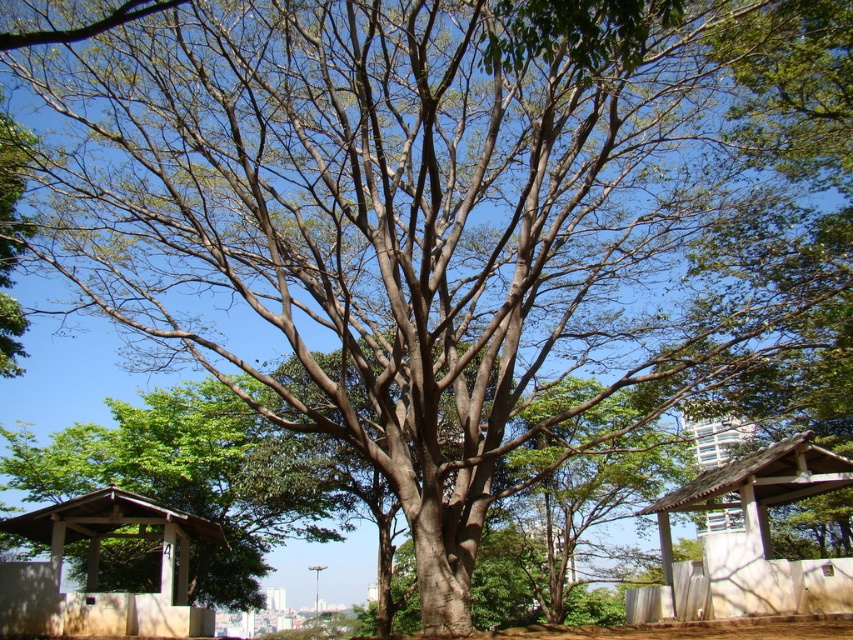
You are planning to install a new lighting system for both the white wood gazebo at lower right and the brown wood gazebo at lower left. Based on their heights, which gazebo will require a taller ladder for installation?

The white wood gazebo at lower right requires a taller ladder because it is much taller than the brown wood gazebo at lower left.

You are standing in the park and want to decide which gazebo to sit under. The white wood gazebo at lower right and the brown wood gazebo at lower left are both options. Based on their sizes, which one could potentially accommodate more people?

The white wood gazebo at lower right might be wider than brown wood gazebo at lower left, so it could potentially accommodate more people.